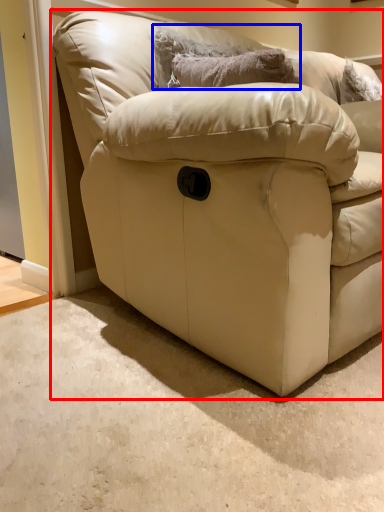
Question: Among these objects, which one is farthest to the camera, studio couch (highlighted by a red box) or pillow (highlighted by a blue box)?

Choices:
 (A) studio couch
 (B) pillow

Answer: (B)